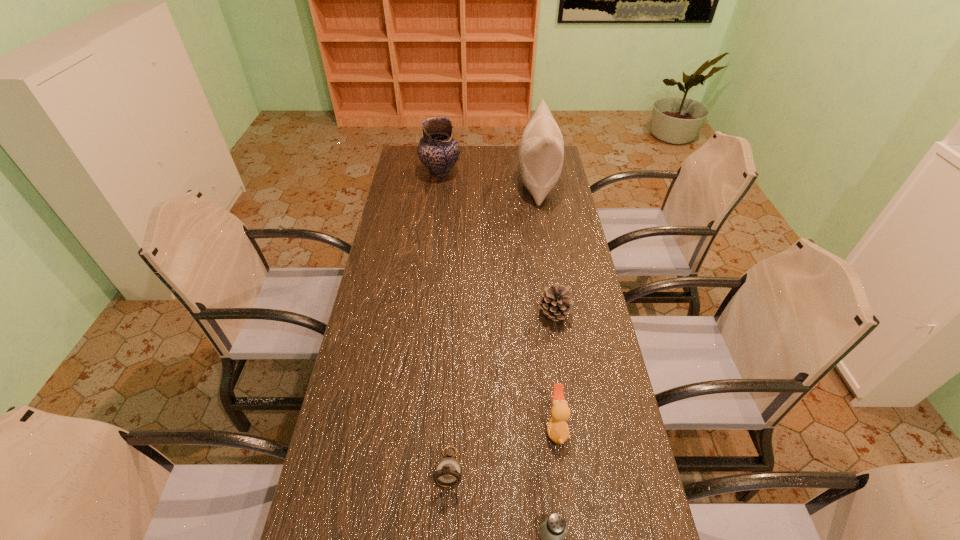
Locate an element on the screen. The image size is (960, 540). blank space located 0.290m on the beak of the duck is located at coordinates (436, 428).

Identify the location of vacant space located 0.120m on the beak of the duck. The image size is (960, 540). (500, 428).

Identify the location of vacant region located 0.330m on the beak of the duck. 421,428.

You are a GUI agent. You are given a task and a screenshot of the screen. Output one action in this format:
    pyautogui.click(x=<x>, y=<y>)
    Task: Click on the vacant space located 0.090m on the face of the compass
    This screenshot has height=540, width=960.
    Given the screenshot: What is the action you would take?
    pyautogui.click(x=445, y=532)

You are a GUI agent. You are given a task and a screenshot of the screen. Output one action in this format:
    pyautogui.click(x=<x>, y=<y>)
    Task: Click on the cushion that is at the far edge
    Image resolution: width=960 pixels, height=540 pixels.
    Given the screenshot: What is the action you would take?
    pyautogui.click(x=541, y=153)

I want to click on pottery present at the far edge, so click(x=438, y=151).

Where is `object located at the left edge`? The image size is (960, 540). object located at the left edge is located at coordinates (438, 151).

Where is `cushion that is at the right edge`? cushion that is at the right edge is located at coordinates (541, 153).

Identify the location of pinecone situated at the right edge. This screenshot has width=960, height=540. (555, 302).

You are a GUI agent. You are given a task and a screenshot of the screen. Output one action in this format:
    pyautogui.click(x=<x>, y=<y>)
    Task: Click on the duck at the right edge
    This screenshot has height=540, width=960.
    Given the screenshot: What is the action you would take?
    pyautogui.click(x=557, y=429)